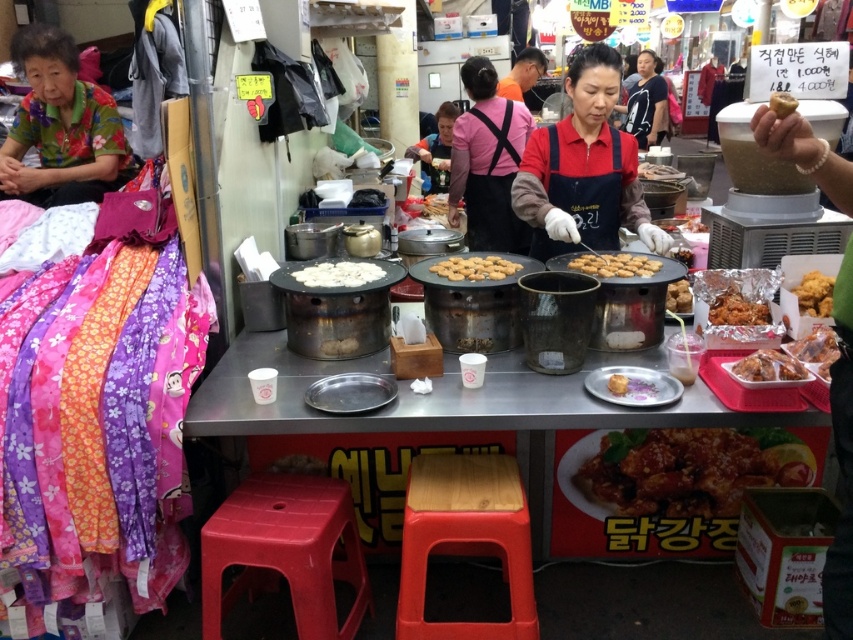
Question: Which point is closer to the camera taking this photo?

Choices:
 (A) (352, 531)
 (B) (585, 136)
 (C) (627, 273)
 (D) (680, 483)

Answer: (A)

Question: Which point is farther from the camera taking this photo?

Choices:
 (A) (741, 371)
 (B) (645, 109)
 (C) (680, 298)

Answer: (B)

Question: Is golden crispy cookie at center in front of golden crispy pastry at center?

Choices:
 (A) no
 (B) yes

Answer: (A)

Question: Can you confirm if golden crispy cookie at center is positioned above shiny golden fried chicken at right?

Choices:
 (A) yes
 (B) no

Answer: (A)

Question: Does saucy fried chicken at center have a greater width compared to matte pink apron at center?

Choices:
 (A) yes
 (B) no

Answer: (A)

Question: Which point is farther to the camera?

Choices:
 (A) matte black shirt at upper center
 (B) floral fabric blouse at upper left

Answer: (A)